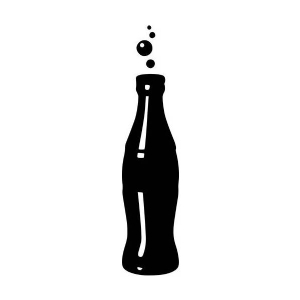
You are a GUI agent. You are given a task and a screenshot of the screen. Output one action in this format:
    pyautogui.click(x=<x>, y=<y>)
    Task: Click on the glass bottle
    
    Given the screenshot: What is the action you would take?
    pyautogui.click(x=152, y=169)